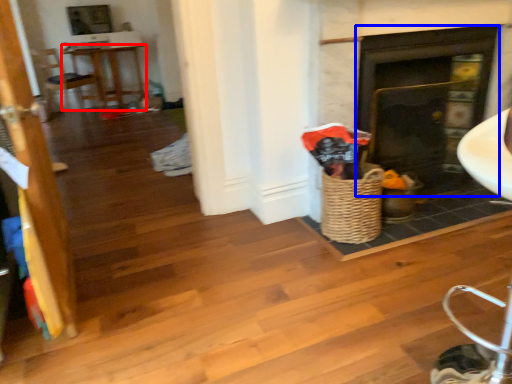
Question: Which point is further to the camera, table (highlighted by a red box) or fireplace (highlighted by a blue box)?

Choices:
 (A) table
 (B) fireplace

Answer: (A)